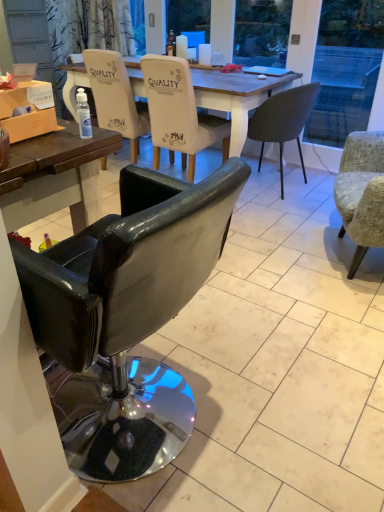
Question: Are matte white chair at center, the first chair viewed from the back, and matte white coffee cup at upper center, marked as the third coffee cup in a left-to-right arrangement, located far from each other?

Choices:
 (A) yes
 (B) no

Answer: (B)

Question: Is matte white chair at center, placed as the 5th chair when sorted from front to back, at the right side of matte white coffee cup at upper center, marked as the third coffee cup in a left-to-right arrangement?

Choices:
 (A) yes
 (B) no

Answer: (B)

Question: Does matte white chair at center, placed as the 5th chair when sorted from front to back, appear on the left side of matte white coffee cup at upper center, marked as the third coffee cup in a left-to-right arrangement?

Choices:
 (A) yes
 (B) no

Answer: (A)

Question: Is matte white coffee cup at upper center, which is the 1th coffee cup from right to left, at the back of matte white chair at center, placed as the 5th chair when sorted from front to back?

Choices:
 (A) no
 (B) yes

Answer: (A)

Question: From a real-world perspective, does matte white chair at center, the first chair viewed from the back, stand above matte white coffee cup at upper center, marked as the third coffee cup in a left-to-right arrangement?

Choices:
 (A) yes
 (B) no

Answer: (B)

Question: Is transparent plastic spray bottle at center bigger or smaller than matte white coffee cup at upper center, which appears as the second coffee cup when viewed from the right?

Choices:
 (A) small
 (B) big

Answer: (A)

Question: Is point (77, 93) positioned closer to the camera than point (210, 59)?

Choices:
 (A) closer
 (B) farther

Answer: (A)

Question: Which is correct: transparent plastic spray bottle at center is inside matte white coffee cup at upper center, which appears as the second coffee cup when viewed from the right, or outside of it?

Choices:
 (A) outside
 (B) inside

Answer: (A)

Question: Considering the positions of transparent plastic spray bottle at center and matte white coffee cup at upper center, which appears as the second coffee cup when viewed from the right, in the image, is transparent plastic spray bottle at center taller or shorter than matte white coffee cup at upper center, which appears as the second coffee cup when viewed from the right,?

Choices:
 (A) short
 (B) tall

Answer: (A)

Question: Is textured gray armchair at right, marked as the fourth chair in a back-to-front arrangement, in front of or behind white fabric chair at center, arranged as the third chair when viewed from the back, in the image?

Choices:
 (A) behind
 (B) front

Answer: (B)

Question: Considering the positions of textured gray armchair at right, marked as the fourth chair in a back-to-front arrangement, and white fabric chair at center, arranged as the third chair when viewed from the back, in the image, is textured gray armchair at right, marked as the fourth chair in a back-to-front arrangement, wider or thinner than white fabric chair at center, arranged as the third chair when viewed from the back,?

Choices:
 (A) wide
 (B) thin

Answer: (B)

Question: Considering the positions of textured gray armchair at right, the second chair when ordered from front to back, and white fabric chair at center, arranged as the third chair when viewed from the front, in the image, is textured gray armchair at right, the second chair when ordered from front to back, bigger or smaller than white fabric chair at center, arranged as the third chair when viewed from the front,?

Choices:
 (A) small
 (B) big

Answer: (A)

Question: From a real-world perspective, relative to white fabric chair at center, arranged as the third chair when viewed from the front, is textured gray armchair at right, marked as the fourth chair in a back-to-front arrangement, vertically above or below?

Choices:
 (A) above
 (B) below

Answer: (B)

Question: From the image's perspective, is black leather chair at lower left, the fifth chair when ordered from back to front, positioned above or below textured gray armchair at right, the second chair when ordered from front to back?

Choices:
 (A) above
 (B) below

Answer: (B)

Question: Is point (135, 445) positioned closer to the camera than point (357, 268)?

Choices:
 (A) farther
 (B) closer

Answer: (B)